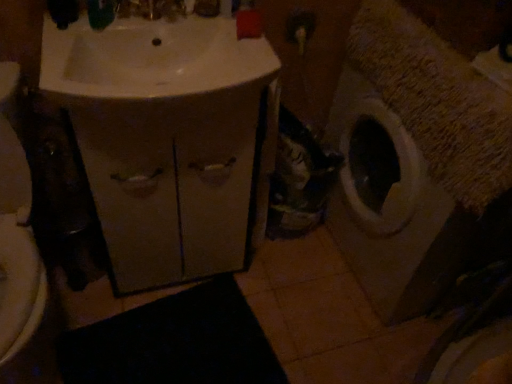
Locate an element on the screen. free space that is in between textured beige washing machine at right and black rubber bath mat at lower center is located at coordinates (301, 317).